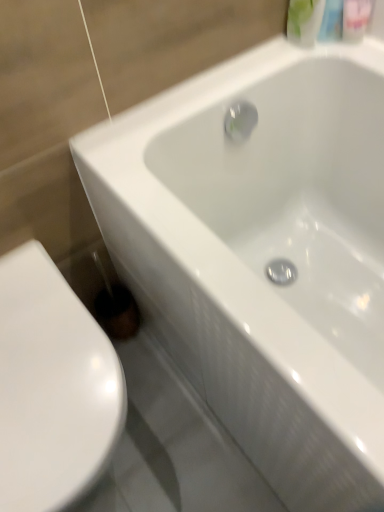
Question: Is point (91, 367) positioned closer to the camera than point (321, 11)?

Choices:
 (A) closer
 (B) farther

Answer: (A)

Question: From the image's perspective, is white glossy toilet at lower left positioned above or below green matte bottle at upper right, the first mouthwash when ordered from left to right?

Choices:
 (A) above
 (B) below

Answer: (B)

Question: Which object is positioned farthest from the translucent plastic mouthwash at upper right, marked as the 2th mouthwash in a left-to-right arrangement?

Choices:
 (A) green matte bottle at upper right, the first mouthwash when ordered from left to right
 (B) white glossy toilet at lower left

Answer: (B)

Question: Estimate the real-world distances between objects in this image. Which object is closer to the green matte bottle at upper right, the first mouthwash when ordered from left to right?

Choices:
 (A) white glossy toilet at lower left
 (B) translucent plastic mouthwash at upper right, which is the first mouthwash from right to left

Answer: (B)